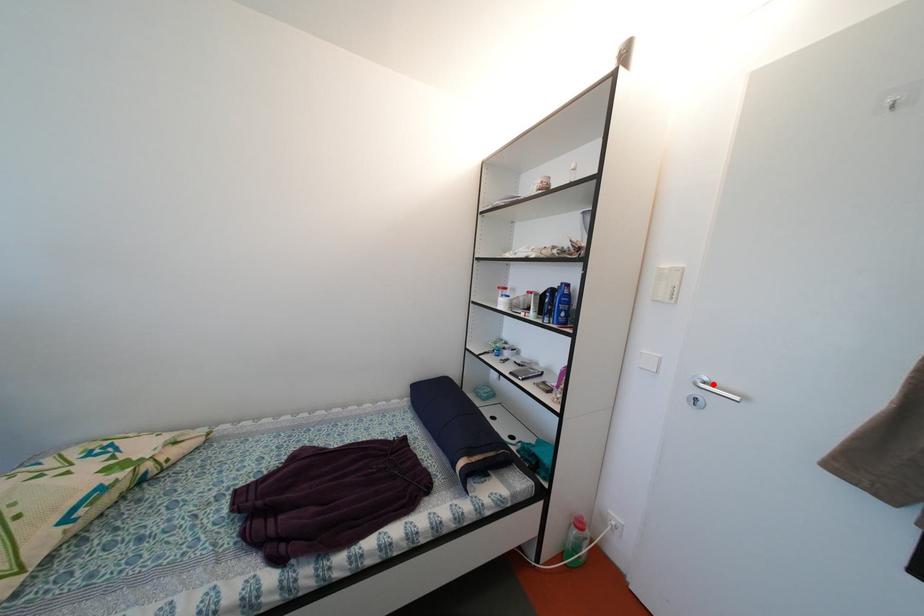
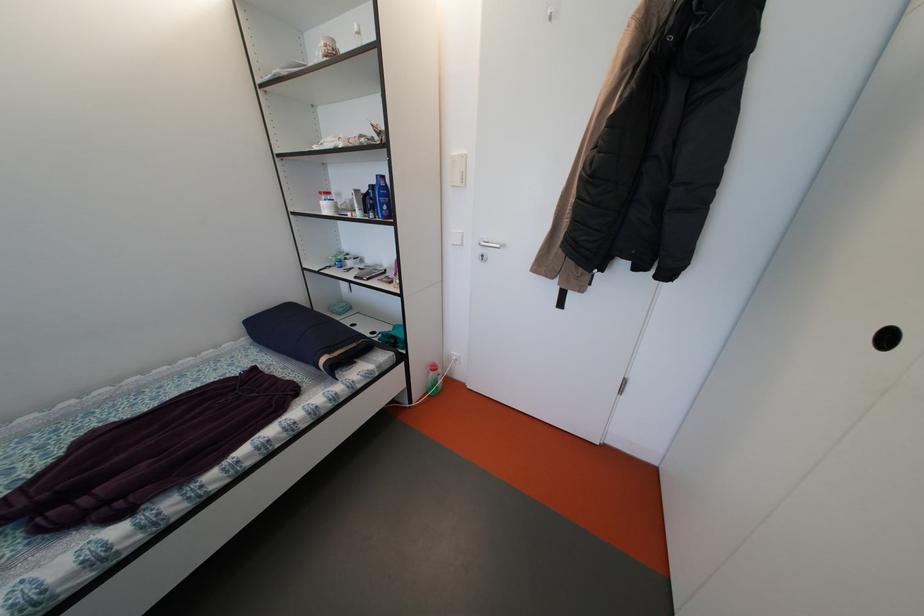
Where in the second image is the point corresponding to the highlighted location from the first image?

(493, 245)